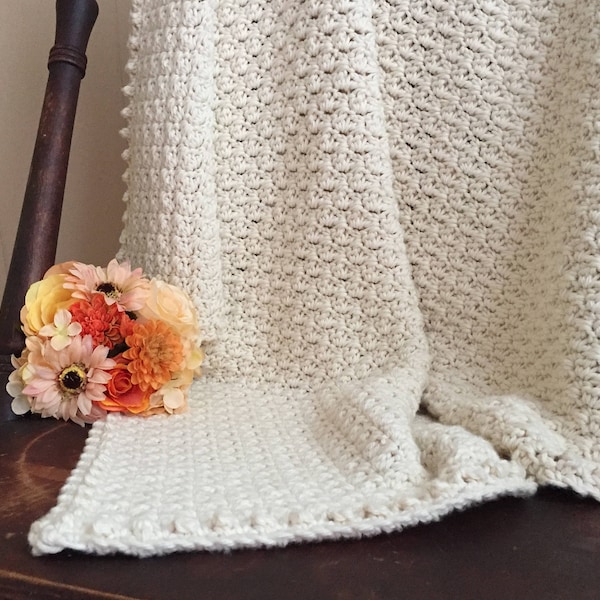
Where is `bouquet`? This screenshot has height=600, width=600. bouquet is located at coordinates (102, 347).